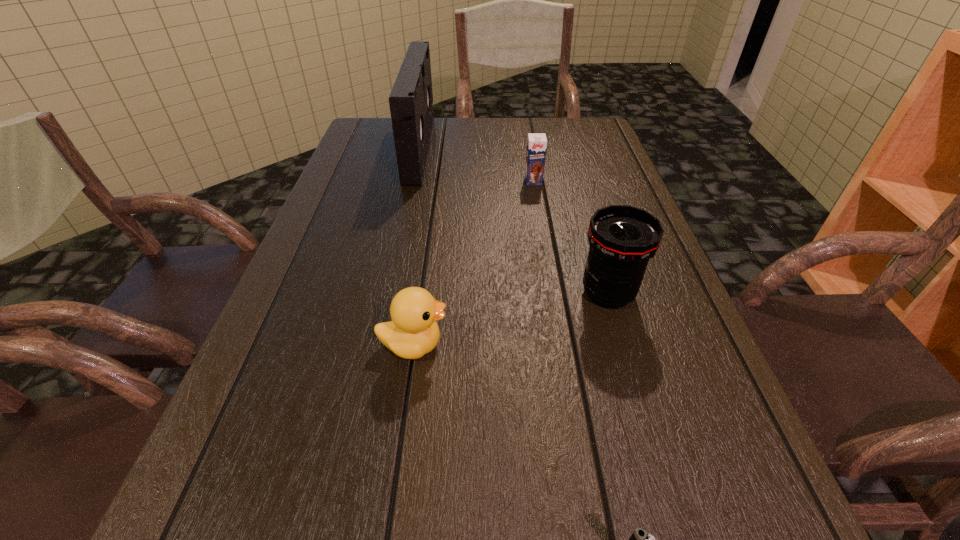
Locate an element on the screen. videotape is located at coordinates (411, 100).

Identify the location of the second tallest object. pos(622,238).

Locate an element on the screen. The height and width of the screenshot is (540, 960). telephoto lens is located at coordinates (622, 238).

The image size is (960, 540). Identify the location of the third object from right to left. (536, 144).

The height and width of the screenshot is (540, 960). Find the location of `the second nearest object`. the second nearest object is located at coordinates (413, 332).

Image resolution: width=960 pixels, height=540 pixels. I want to click on vacant space situated 0.280m on the side of the tallest object with visible spindles, so click(x=522, y=148).

Where is `blank space located on the front of the telephoto lens`? Image resolution: width=960 pixels, height=540 pixels. blank space located on the front of the telephoto lens is located at coordinates (624, 346).

Where is `vacant position located on the front label of the third object from right to left`? The image size is (960, 540). vacant position located on the front label of the third object from right to left is located at coordinates (552, 291).

Image resolution: width=960 pixels, height=540 pixels. What are the coordinates of `blank area located on the face of the duck` in the screenshot? It's located at (645, 345).

The image size is (960, 540). What are the coordinates of `object at the far edge` in the screenshot? It's located at (411, 100).